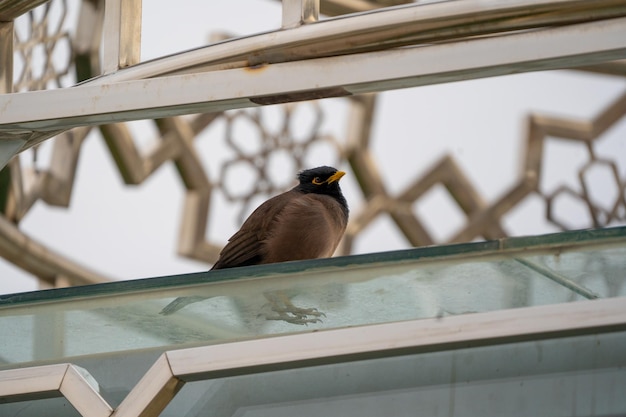
Locate an element on the screen. glass is located at coordinates (429, 286).